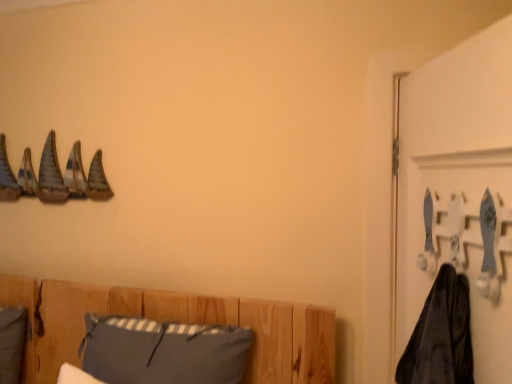
You are a GUI agent. You are given a task and a screenshot of the screen. Output one action in this format:
    pyautogui.click(x=<x>, y=<y>)
    Task: Click on the dark gray fabric pillow at center
    The height and width of the screenshot is (384, 512).
    Given the screenshot: What is the action you would take?
    pyautogui.click(x=163, y=351)

The image size is (512, 384). Describe the element at coordinates (163, 351) in the screenshot. I see `dark gray fabric pillow at center` at that location.

The height and width of the screenshot is (384, 512). I want to click on dark gray fabric pillow at center, so click(163, 351).